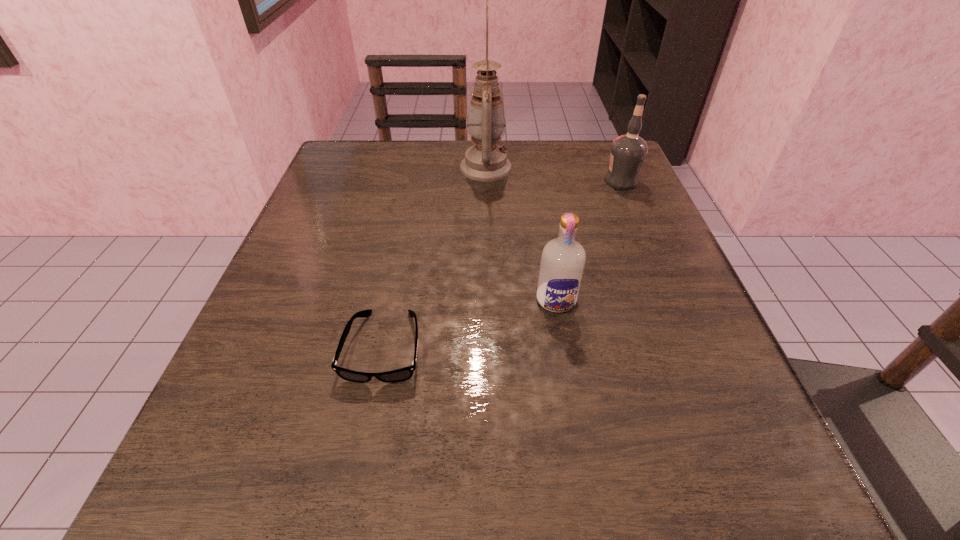
You are a GUI agent. You are given a task and a screenshot of the screen. Output one action in this format:
    pyautogui.click(x=<x>, y=<y>)
    Task: Click on the free space located on the front label of the farther vodka
    The width and height of the screenshot is (960, 540).
    Given the screenshot: What is the action you would take?
    pyautogui.click(x=506, y=181)

In order to click on vacant region located on the front label of the farther vodka in this screenshot , I will do `click(452, 181)`.

This screenshot has height=540, width=960. I want to click on vacant point located on the label of the second shortest object, so click(x=588, y=483).

Where is `free space located 0.120m on the front-facing side of the sunglasses`? The image size is (960, 540). free space located 0.120m on the front-facing side of the sunglasses is located at coordinates (359, 476).

Identify the location of oil lamp positioned at the far edge. The width and height of the screenshot is (960, 540). (485, 161).

Where is `vodka that is at the far edge`? The height and width of the screenshot is (540, 960). vodka that is at the far edge is located at coordinates (628, 152).

Locate an element on the screen. Image resolution: width=960 pixels, height=540 pixels. object present at the left edge is located at coordinates (402, 374).

Image resolution: width=960 pixels, height=540 pixels. In order to click on object present at the right edge in this screenshot , I will do `click(628, 152)`.

Find the location of a particular element. object present at the far right corner is located at coordinates (628, 152).

Locate an element on the screen. Image resolution: width=960 pixels, height=540 pixels. vacant area at the far edge is located at coordinates (548, 177).